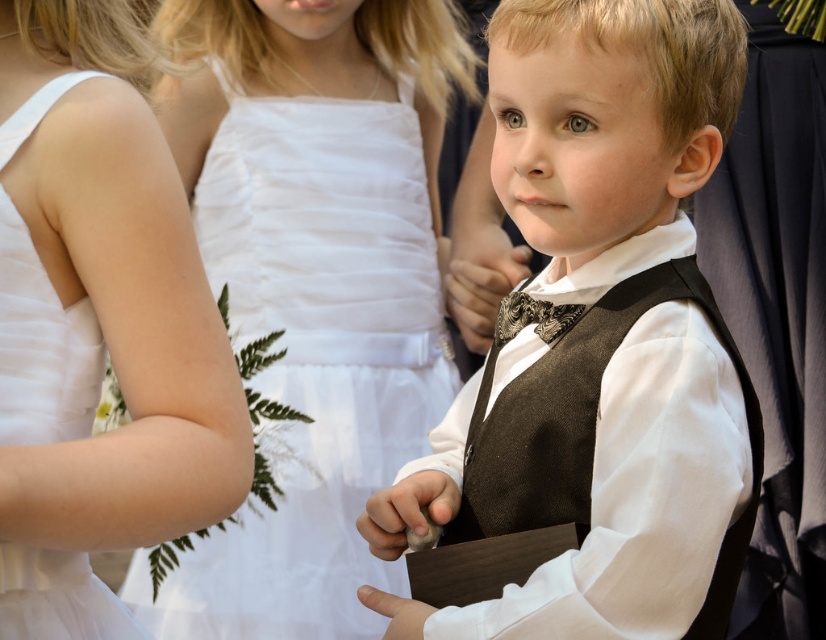
Is point (321, 259) positioned after point (535, 301)?

Yes, it is.

Can you confirm if white tulle dress at center is wider than shiny metallic bow tie at center?

Yes.

In the scene shown: Who is more distant from viewer, (x=312, y=122) or (x=504, y=314)?

The point (x=312, y=122) is behind.

Identify the location of white tulle dress at center. Image resolution: width=826 pixels, height=640 pixels. (316, 355).

How much distance is there between white tulle dress at center and white satin dress at upper left?

white tulle dress at center is 3.76 feet from white satin dress at upper left.

Is white tulle dress at center wider than white satin dress at upper left?

Indeed, white tulle dress at center has a greater width compared to white satin dress at upper left.

I want to click on white tulle dress at center, so click(316, 355).

Find the location of a particular element. This screenshot has height=640, width=826. white tulle dress at center is located at coordinates (316, 355).

Between matte brown vest at center and white tulle dress at center, which one has more height?

white tulle dress at center is taller.

Between matte brown vest at center and white tulle dress at center, which one appears on the right side from the viewer's perspective?

Positioned to the right is matte brown vest at center.

Which is behind, point (397, 604) or point (438, 358)?

Positioned behind is point (438, 358).

Find the location of a particular element. The width and height of the screenshot is (826, 640). matte brown vest at center is located at coordinates (599, 340).